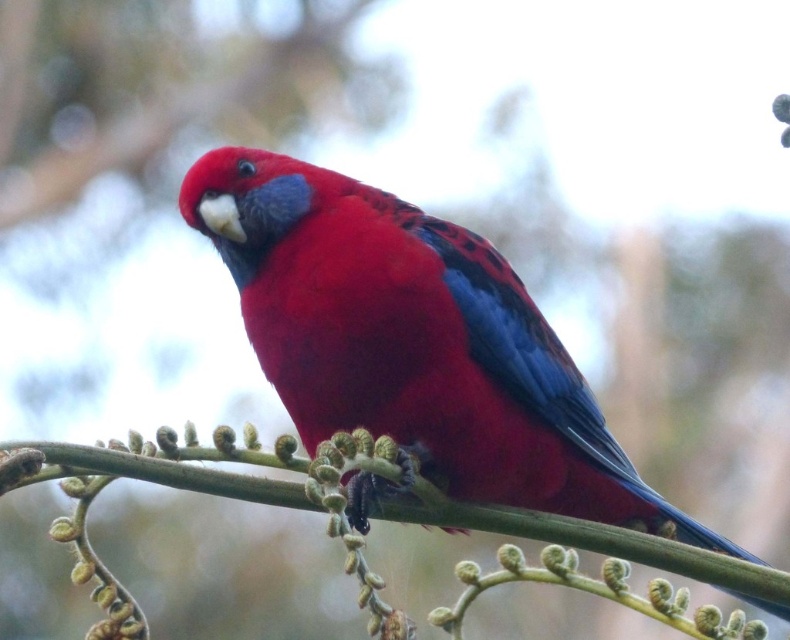
Between matte red parrot at center and green textured branch at center, which one appears on the right side from the viewer's perspective?

matte red parrot at center is more to the right.

Is matte red parrot at center positioned in front of green textured branch at center?

That is False.

Does point (414, 310) lie in front of point (567, 518)?

No, it is behind (567, 518).

Locate an element on the screen. matte red parrot at center is located at coordinates (414, 340).